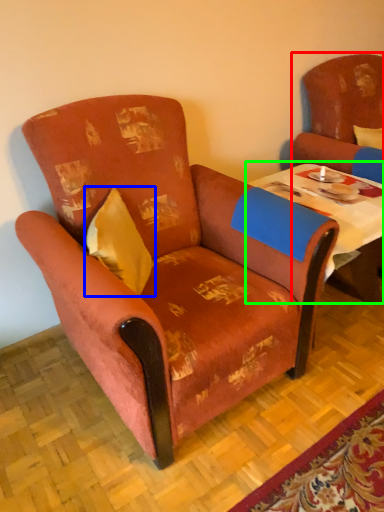
Question: Estimate the real-world distances between objects in this image. Which object is closer to chair (highlighted by a red box), pillow (highlighted by a blue box) or table (highlighted by a green box)?

Choices:
 (A) pillow
 (B) table

Answer: (B)